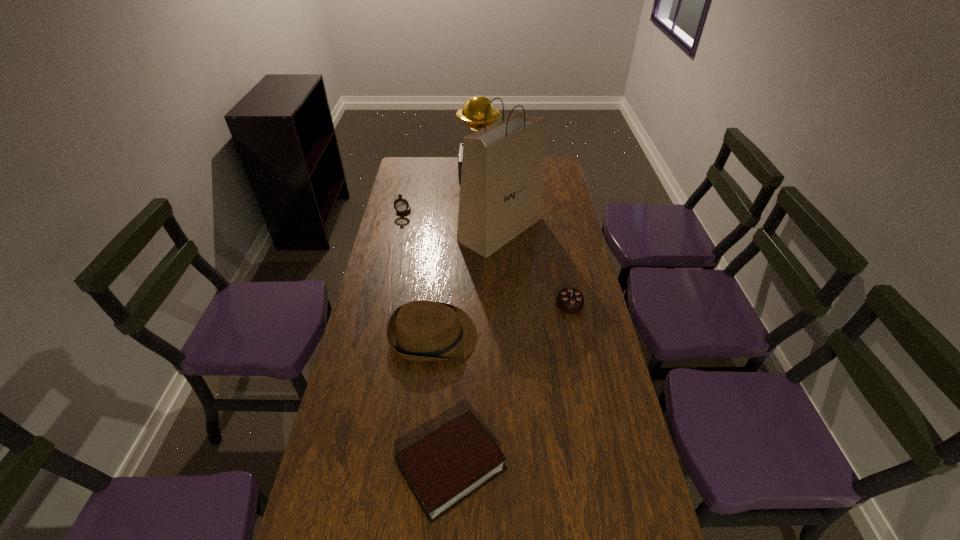
You are a GUI agent. You are given a task and a screenshot of the screen. Output one action in this format:
    pyautogui.click(x=<x>, y=<y>)
    Task: Click on the tallest object
    This screenshot has width=960, height=540.
    Given the screenshot: What is the action you would take?
    pyautogui.click(x=501, y=179)

You are a GUI agent. You are given a task and a screenshot of the screen. Output one action in this format:
    pyautogui.click(x=<x>, y=<y>)
    Task: Click on the award
    
    Given the screenshot: What is the action you would take?
    pyautogui.click(x=473, y=112)

Image resolution: width=960 pixels, height=540 pixels. Find the location of `the farthest object`. the farthest object is located at coordinates (473, 112).

The height and width of the screenshot is (540, 960). In order to click on fedora in this screenshot , I will do `click(421, 330)`.

This screenshot has height=540, width=960. Find the location of `the leftmost object`. the leftmost object is located at coordinates (401, 205).

Identify the location of chocolate cake. (569, 300).

Identify the location of the nearest object. This screenshot has height=540, width=960. (445, 467).

The image size is (960, 540). Identify the location of free space located on the back of the tallest object. (498, 184).

What are the coordinates of `free space located 0.270m on the front-facing side of the award` in the screenshot? It's located at (555, 172).

I want to click on free location located 0.120m on the front-facing side of the fedora, so click(516, 336).